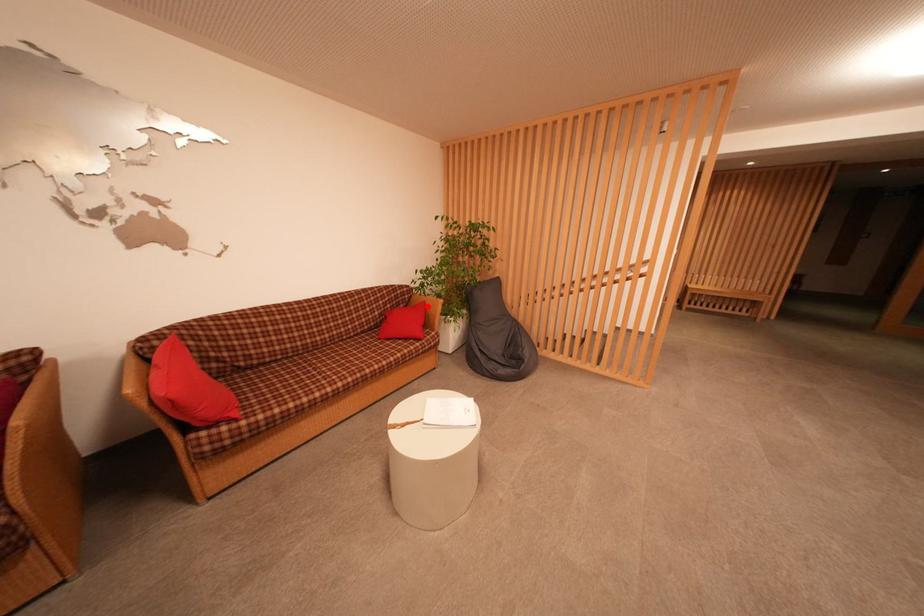
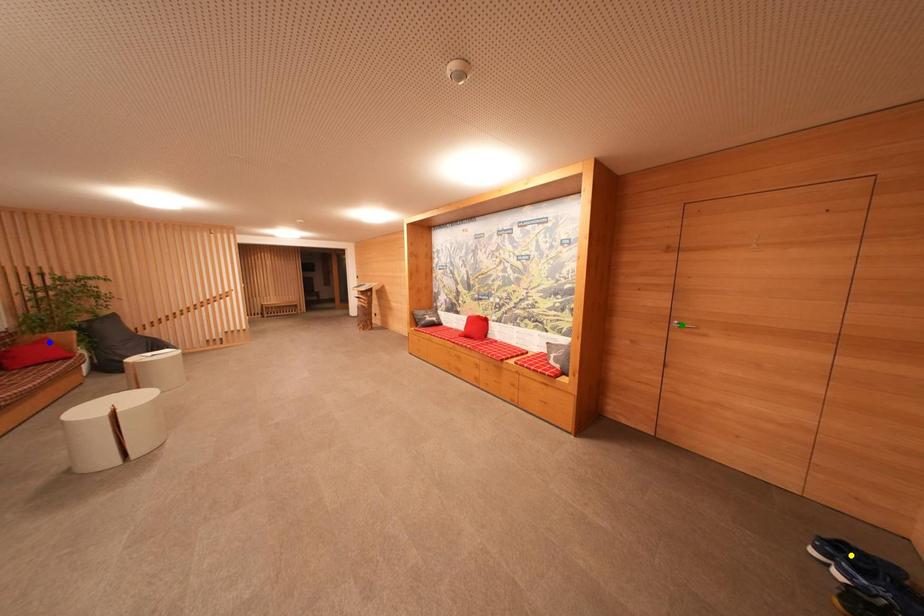
Question: I am providing you with two images of the same scene from different viewpoints. A red point is marked on the first image. You are given multiple points on the second image. Which spot in image 2 lines up with the point in image 1?

Choices:
 (A) blue point
 (B) yellow point
 (C) green point

Answer: (A)